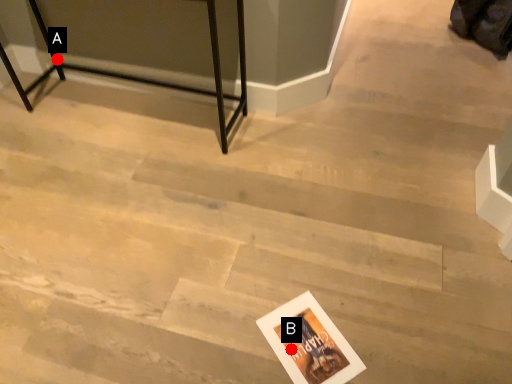
Question: Two points are circled on the image, labeled by A and B beside each circle. Which point appears farthest from the camera in this image?

Choices:
 (A) A is further
 (B) B is further

Answer: (A)